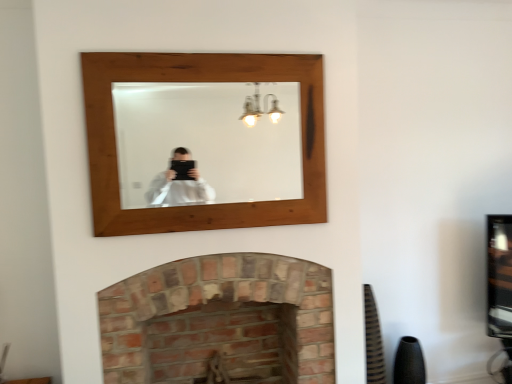
Question: Is wooden mirror at upper center to the right of brick fireplace at lower center from the viewer's perspective?

Choices:
 (A) no
 (B) yes

Answer: (A)

Question: Is brick fireplace at lower center at the back of wooden mirror at upper center?

Choices:
 (A) no
 (B) yes

Answer: (A)

Question: Is the position of wooden mirror at upper center less distant than that of brick fireplace at lower center?

Choices:
 (A) yes
 (B) no

Answer: (A)

Question: Does wooden mirror at upper center have a greater height compared to brick fireplace at lower center?

Choices:
 (A) yes
 (B) no

Answer: (B)

Question: Is wooden mirror at upper center at the left side of brick fireplace at lower center?

Choices:
 (A) yes
 (B) no

Answer: (A)

Question: Is wooden mirror at upper center aimed at brick fireplace at lower center?

Choices:
 (A) yes
 (B) no

Answer: (B)

Question: From a real-world perspective, is brick fireplace at lower center physically above wooden mirror at upper center?

Choices:
 (A) no
 (B) yes

Answer: (A)

Question: Is brick fireplace at lower center at the left side of wooden mirror at upper center?

Choices:
 (A) no
 (B) yes

Answer: (A)

Question: Considering the relative sizes of brick fireplace at lower center and wooden mirror at upper center in the image provided, is brick fireplace at lower center wider than wooden mirror at upper center?

Choices:
 (A) no
 (B) yes

Answer: (B)

Question: Is brick fireplace at lower center facing away from wooden mirror at upper center?

Choices:
 (A) no
 (B) yes

Answer: (A)

Question: Does brick fireplace at lower center have a greater height compared to wooden mirror at upper center?

Choices:
 (A) yes
 (B) no

Answer: (A)

Question: Is wooden mirror at upper center inside brick fireplace at lower center?

Choices:
 (A) yes
 (B) no

Answer: (B)

Question: From the image's perspective, relative to brick fireplace at lower center, is wooden mirror at upper center above or below?

Choices:
 (A) above
 (B) below

Answer: (A)